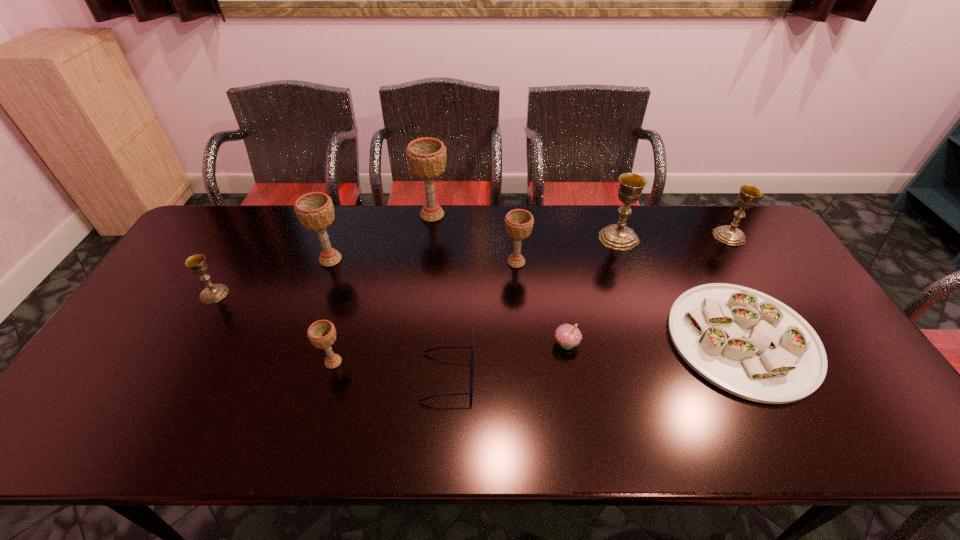
This screenshot has height=540, width=960. In order to click on free space between the eighth object from right to left and the tallest chalice in this screenshot , I will do `click(383, 288)`.

At what (x,y) coordinates should I click in order to perform the action: click on free space that is in between the platter and the ninth object from right to left. Please return your answer as a coordinate pair (x, y). This screenshot has width=960, height=540. Looking at the image, I should click on (537, 300).

Locate an element on the screen. The width and height of the screenshot is (960, 540). blank region between the fifth chalice from right to left and the second object from left to right is located at coordinates (332, 311).

The height and width of the screenshot is (540, 960). In order to click on vacant area that lies between the ninth tallest object and the spectacles in this screenshot , I will do `click(594, 359)`.

Find the location of a particular element. Image resolution: width=960 pixels, height=540 pixels. vacant point located between the biggest gold chalice and the rightmost chalice is located at coordinates (674, 237).

In order to click on vacant space that is in between the shortest object and the white platter in this screenshot , I will do `click(594, 359)`.

The image size is (960, 540). Find the location of `free space between the fourth chalice from right to left and the second smallest gold chalice`. free space between the fourth chalice from right to left and the second smallest gold chalice is located at coordinates [x=581, y=226].

Where is `free space that is in between the second chalice from right to left and the leftmost beige chalice`? The image size is (960, 540). free space that is in between the second chalice from right to left and the leftmost beige chalice is located at coordinates click(x=474, y=249).

Identify which object is located as the ninth nearest to the eighth tallest object. Please provide its 2D coordinates. Your answer should be formatted as a tuple, i.e. [(x, y)], where the tuple contains the x and y coordinates of a point satisfying the conditions above.

[(213, 293)]

Locate which object is the eighth closest to the rightmost gold chalice. Please provide its 2D coordinates. Your answer should be formatted as a tuple, i.e. [(x, y)], where the tuple contains the x and y coordinates of a point satisfying the conditions above.

[(315, 210)]